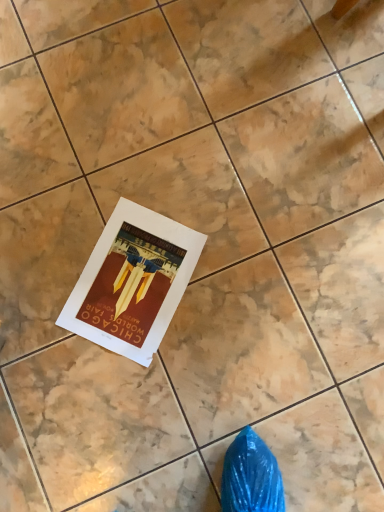
Locate an element on the screen. This screenshot has height=512, width=384. free space in front of matte paper poster at center is located at coordinates (121, 399).